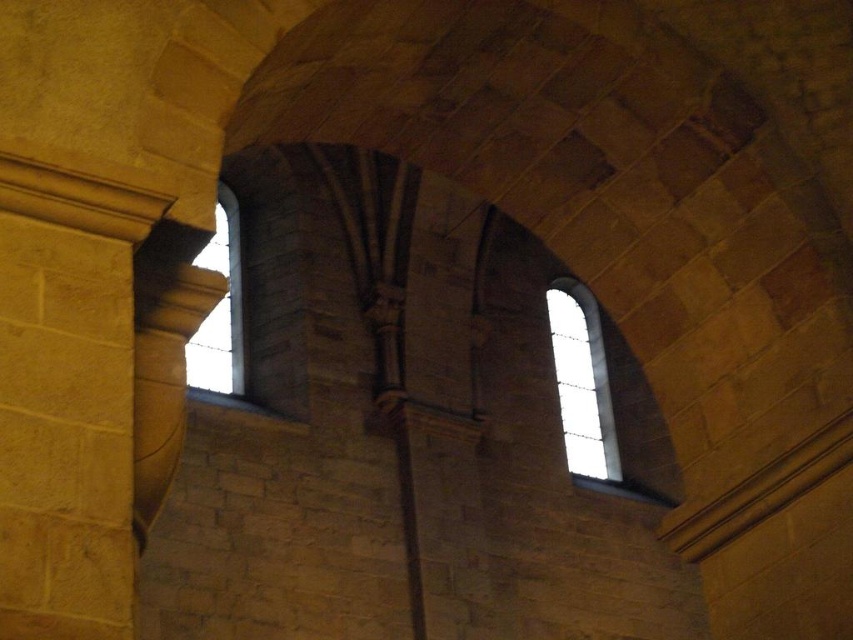
This screenshot has width=853, height=640. What are the coordinates of `clear glass window at upper right` in the screenshot? It's located at (582, 380).

Is point (572, 440) closer to camera compared to point (219, 365)?

No, (572, 440) is behind (219, 365).

Identify the location of clear glass window at upper right. This screenshot has width=853, height=640. (582, 380).